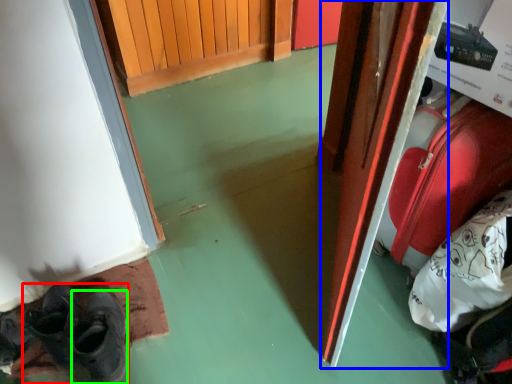
Question: Which is farther away from footwear (highlighted by a red box)? door (highlighted by a blue box) or shoe (highlighted by a green box)?

Choices:
 (A) door
 (B) shoe

Answer: (A)